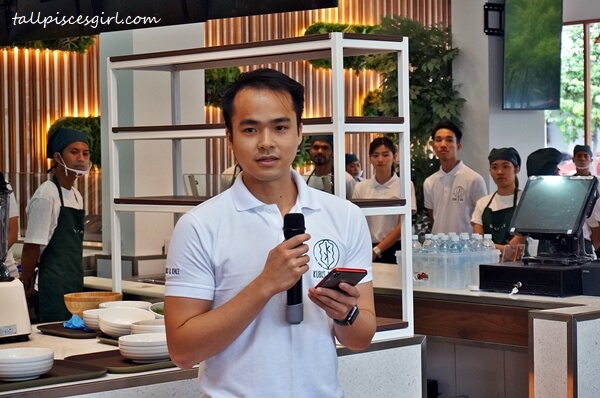
Where is `countertop`? countertop is located at coordinates (58, 344).